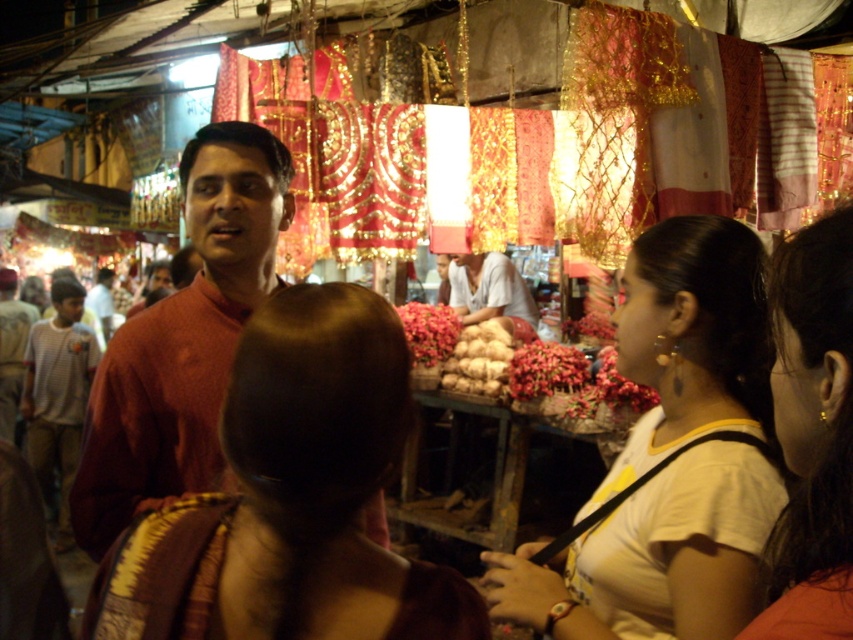
Question: Among these objects, which one is nearest to the camera?

Choices:
 (A) white cotton shirt at center
 (B) matte brown shirt at center
 (C) white matte shirt at center
 (D) white fabric hair at upper right

Answer: (D)

Question: Which of these objects is positioned farthest from the light brown cotton shirt at left?

Choices:
 (A) matte brown shirt at center
 (B) white cotton shirt at center

Answer: (A)

Question: Among these objects, which one is farthest from the camera?

Choices:
 (A) brown textured sari at center
 (B) white matte shirt at center
 (C) matte brown shirt at center

Answer: (C)

Question: Is matte red shirt at center positioned before white cotton shirt at center?

Choices:
 (A) no
 (B) yes

Answer: (B)

Question: Does white matte shirt at center have a lesser width compared to matte red shirt at center?

Choices:
 (A) no
 (B) yes

Answer: (A)

Question: Is matte red shirt at center below white cotton shirt at center?

Choices:
 (A) no
 (B) yes

Answer: (B)